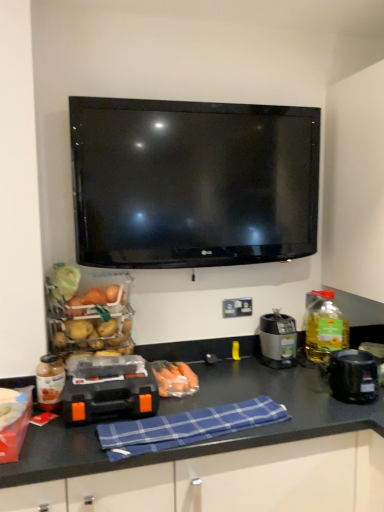
Describe the element at coordinates (324, 327) in the screenshot. I see `yellow translucent bottle at right, which appears as the second bottle when viewed from the left` at that location.

Find the location of `matte plastic basket of vegetables at left, acting as the first food starting from the left`. matte plastic basket of vegetables at left, acting as the first food starting from the left is located at coordinates (92, 322).

What do you see at coordinates (352, 375) in the screenshot?
I see `black plastic coffee maker at right, positioned as the 3th appliance in left-to-right order` at bounding box center [352, 375].

Describe the element at coordinates (278, 340) in the screenshot. Image resolution: width=384 pixels, height=512 pixels. I see `satin silver coffee maker at center-right, which is counted as the 2th appliance, starting from the left` at that location.

The height and width of the screenshot is (512, 384). I want to click on orange plastic toolbox at center, the 3th appliance from the back, so click(x=110, y=399).

From a real-world perspective, is blue plaid cloth at center located beneath matte plastic basket of vegetables at left, positioned as the 2th food in bottom-to-top order?

Yes, from a real-world perspective, blue plaid cloth at center is below matte plastic basket of vegetables at left, positioned as the 2th food in bottom-to-top order.

Is blue plaid cloth at center shorter than matte plastic basket of vegetables at left, placed as the 1th food when sorted from top to bottom?

Correct, blue plaid cloth at center is not as tall as matte plastic basket of vegetables at left, placed as the 1th food when sorted from top to bottom.

Is blue plaid cloth at center outside of matte plastic basket of vegetables at left, which appears as the second food when viewed from the right?

Yes, blue plaid cloth at center is not within matte plastic basket of vegetables at left, which appears as the second food when viewed from the right.

Considering the positions of point (341, 394) and point (261, 330), is point (341, 394) closer or farther from the camera than point (261, 330)?

Point (341, 394).

Considering the sizes of objects black plastic coffee maker at right, which is the second appliance in front-to-back order, and satin silver coffee maker at center-right, arranged as the 1th appliance when viewed from the back, in the image provided, who is wider, black plastic coffee maker at right, which is the second appliance in front-to-back order, or satin silver coffee maker at center-right, arranged as the 1th appliance when viewed from the back,?

Wider between the two is black plastic coffee maker at right, which is the second appliance in front-to-back order.

Are black plastic coffee maker at right, the second appliance when ordered from back to front, and satin silver coffee maker at center-right, which appears as the 3th appliance when viewed from the front, making contact?

No, black plastic coffee maker at right, the second appliance when ordered from back to front, is not making contact with satin silver coffee maker at center-right, which appears as the 3th appliance when viewed from the front.

Between black plastic coffee maker at right, positioned as the 3th appliance in left-to-right order, and satin silver coffee maker at center-right, arranged as the 1th appliance when viewed from the back, which one has smaller size?

With smaller size is black plastic coffee maker at right, positioned as the 3th appliance in left-to-right order.

From a real-world perspective, between blue plaid cloth at center and translucent glass bottle at left, marked as the 1th bottle in a front-to-back arrangement, who is vertically higher?

In real-world perspective, translucent glass bottle at left, marked as the 1th bottle in a front-to-back arrangement, is above.

What's the angular difference between blue plaid cloth at center and translucent glass bottle at left, which is the second bottle in back-to-front order,'s facing directions?

There is a 8.32-degree angle between the facing directions of blue plaid cloth at center and translucent glass bottle at left, which is the second bottle in back-to-front order.

Identify the location of the 1st bottle directly above the blue plaid cloth at center (from a real-world perspective). (50, 381).

Is blue plaid cloth at center positioned in front of translucent glass bottle at left, marked as the 1th bottle in a front-to-back arrangement?

Yes, it is in front of translucent glass bottle at left, marked as the 1th bottle in a front-to-back arrangement.

Is translucent glass bottle at left, which is the second bottle in back-to-front order, at the left side of translucent plastic carrots at center, which is counted as the first food, starting from the right?

Yes.

Based on their sizes in the image, would you say translucent glass bottle at left, which is the second bottle in back-to-front order, is bigger or smaller than translucent plastic carrots at center, the 2th food from the top?

Clearly, translucent glass bottle at left, which is the second bottle in back-to-front order, is smaller in size than translucent plastic carrots at center, the 2th food from the top.

Where is `food that is the 2nd object located behind the translucent glass bottle at left, marked as the 1th bottle in a front-to-back arrangement`? Image resolution: width=384 pixels, height=512 pixels. food that is the 2nd object located behind the translucent glass bottle at left, marked as the 1th bottle in a front-to-back arrangement is located at coordinates (176, 380).

Considering the relative sizes of yellow translucent bottle at right, the first bottle in the right-to-left sequence, and black plastic coffee maker at right, positioned as the 3th appliance in left-to-right order, in the image provided, is yellow translucent bottle at right, the first bottle in the right-to-left sequence, bigger than black plastic coffee maker at right, positioned as the 3th appliance in left-to-right order,?

Yes, yellow translucent bottle at right, the first bottle in the right-to-left sequence, is bigger than black plastic coffee maker at right, positioned as the 3th appliance in left-to-right order.

Find the location of a particular element. This screenshot has height=512, width=384. the 1st appliance counting from the left side of the yellow translucent bottle at right, the first bottle in the right-to-left sequence is located at coordinates (352, 375).

Can you confirm if yellow translucent bottle at right, arranged as the 1th bottle when viewed from the back, is wider than black plastic coffee maker at right, positioned as the 3th appliance in left-to-right order?

No, yellow translucent bottle at right, arranged as the 1th bottle when viewed from the back, is not wider than black plastic coffee maker at right, positioned as the 3th appliance in left-to-right order.

Is yellow translucent bottle at right, placed as the 2th bottle when sorted from front to back, looking in the opposite direction of black plastic coffee maker at right, positioned as the 3th appliance in left-to-right order?

No, yellow translucent bottle at right, placed as the 2th bottle when sorted from front to back, is not facing away from black plastic coffee maker at right, positioned as the 3th appliance in left-to-right order.

Is satin silver coffee maker at center-right, which appears as the 3th appliance when viewed from the front, situated inside matte plastic basket of vegetables at left, acting as the first food starting from the left, or outside?

satin silver coffee maker at center-right, which appears as the 3th appliance when viewed from the front, is spatially situated outside matte plastic basket of vegetables at left, acting as the first food starting from the left.

From the matte plastic basket of vegetables at left, which appears as the second food when viewed from the right, count 2nd appliance to the right and point to it. Please provide its 2D coordinates.

[(278, 340)]

From a real-world perspective, is satin silver coffee maker at center-right, arranged as the 1th appliance when viewed from the back, on top of matte plastic basket of vegetables at left, which appears as the second food when viewed from the right?

No, from a real-world perspective, satin silver coffee maker at center-right, arranged as the 1th appliance when viewed from the back, is not over matte plastic basket of vegetables at left, which appears as the second food when viewed from the right

Is point (286, 321) positioned after point (125, 342)?

Yes, it is.

Can you see orange plastic toolbox at center, marked as the first appliance in a front-to-back arrangement, touching white plastic electrical outlet at center?

No, orange plastic toolbox at center, marked as the first appliance in a front-to-back arrangement, is not beside white plastic electrical outlet at center.

From a real-world perspective, which is physically below, orange plastic toolbox at center, acting as the 3th appliance starting from the right, or white plastic electrical outlet at center?

orange plastic toolbox at center, acting as the 3th appliance starting from the right, from a real-world perspective.

From the image's perspective, does orange plastic toolbox at center, marked as the first appliance in a front-to-back arrangement, appear higher than white plastic electrical outlet at center?

No, from the image's perspective, orange plastic toolbox at center, marked as the first appliance in a front-to-back arrangement, is not over white plastic electrical outlet at center.

Between orange plastic toolbox at center, marked as the first appliance in a front-to-back arrangement, and white plastic electrical outlet at center, which one has less height?

With less height is white plastic electrical outlet at center.

Identify the location of food that is the 2nd one when counting leftward from the blue plaid cloth at center. (92, 322).

Identify the location of appliance above the black plastic coffee maker at right, which appears as the 1th appliance when viewed from the right (from the image's perspective). The width and height of the screenshot is (384, 512). (278, 340).

Which object lies further to the anchor point orange plastic toolbox at center, which is the first appliance in left-to-right order, blue plaid cloth at center or satin silver coffee maker at center-right, which is counted as the 2th appliance, starting from the left?

The object further to orange plastic toolbox at center, which is the first appliance in left-to-right order, is satin silver coffee maker at center-right, which is counted as the 2th appliance, starting from the left.

Considering their positions, is translucent glass bottle at left, marked as the 1th bottle in a front-to-back arrangement, positioned further to orange plastic toolbox at center, marked as the first appliance in a front-to-back arrangement, than yellow translucent bottle at right, arranged as the 1th bottle when viewed from the back?

Based on the image, yellow translucent bottle at right, arranged as the 1th bottle when viewed from the back, appears to be further to orange plastic toolbox at center, marked as the first appliance in a front-to-back arrangement.

Estimate the real-world distances between objects in this image. Which object is further from translucent glass bottle at left, the second bottle when ordered from right to left, black plastic coffee maker at right, which appears as the 1th appliance when viewed from the right, or orange plastic toolbox at center, the 3th appliance from the back?

The object further to translucent glass bottle at left, the second bottle when ordered from right to left, is black plastic coffee maker at right, which appears as the 1th appliance when viewed from the right.

When comparing their distances from blue plaid cloth at center, does satin silver coffee maker at center-right, arranged as the 1th appliance when viewed from the back, or black plastic coffee maker at right, which appears as the 1th appliance when viewed from the right, seem closer?

Based on the image, black plastic coffee maker at right, which appears as the 1th appliance when viewed from the right, appears to be nearer to blue plaid cloth at center.

Looking at the image, which one is located closer to matte plastic basket of vegetables at left, placed as the 1th food when sorted from top to bottom, translucent glass bottle at left, the second bottle when ordered from right to left, or satin silver coffee maker at center-right, which appears as the 3th appliance when viewed from the front?

translucent glass bottle at left, the second bottle when ordered from right to left, is positioned closer to the anchor matte plastic basket of vegetables at left, placed as the 1th food when sorted from top to bottom.

Estimate the real-world distances between objects in this image. Which object is further from yellow translucent bottle at right, which appears as the second bottle when viewed from the left, blue plaid cloth at center or orange plastic toolbox at center, marked as the first appliance in a front-to-back arrangement?

orange plastic toolbox at center, marked as the first appliance in a front-to-back arrangement, is positioned further to the anchor yellow translucent bottle at right, which appears as the second bottle when viewed from the left.

Looking at the image, which one is located closer to black plastic coffee maker at right, positioned as the 3th appliance in left-to-right order, translucent plastic carrots at center, which is counted as the first food, starting from the right, or satin silver coffee maker at center-right, arranged as the 1th appliance when viewed from the back?

satin silver coffee maker at center-right, arranged as the 1th appliance when viewed from the back.

When comparing their distances from yellow translucent bottle at right, placed as the 2th bottle when sorted from front to back, does black plastic coffee maker at right, which is the second appliance in front-to-back order, or orange plastic toolbox at center, the 3th appliance from the back, seem closer?

black plastic coffee maker at right, which is the second appliance in front-to-back order, lies closer to yellow translucent bottle at right, placed as the 2th bottle when sorted from front to back, than the other object.

Locate an element on the screen. This screenshot has width=384, height=512. cloth located between orange plastic toolbox at center, which is the first appliance in left-to-right order, and yellow translucent bottle at right, placed as the 2th bottle when sorted from front to back, in the left-right direction is located at coordinates (186, 426).

This screenshot has height=512, width=384. I want to click on electric outlet between orange plastic toolbox at center, acting as the 3th appliance starting from the right, and yellow translucent bottle at right, arranged as the 1th bottle when viewed from the back, in the horizontal direction, so click(237, 307).

Find the location of a particular element. Image resolution: width=384 pixels, height=512 pixels. appliance located between matte plastic basket of vegetables at left, placed as the 1th food when sorted from top to bottom, and white plastic electrical outlet at center in the left-right direction is located at coordinates (110, 399).

Find the location of `food situated between translucent glass bottle at left, which is counted as the first bottle, starting from the left, and translucent plastic carrots at center, the 2th food from the top, from left to right`. food situated between translucent glass bottle at left, which is counted as the first bottle, starting from the left, and translucent plastic carrots at center, the 2th food from the top, from left to right is located at coordinates (92, 322).